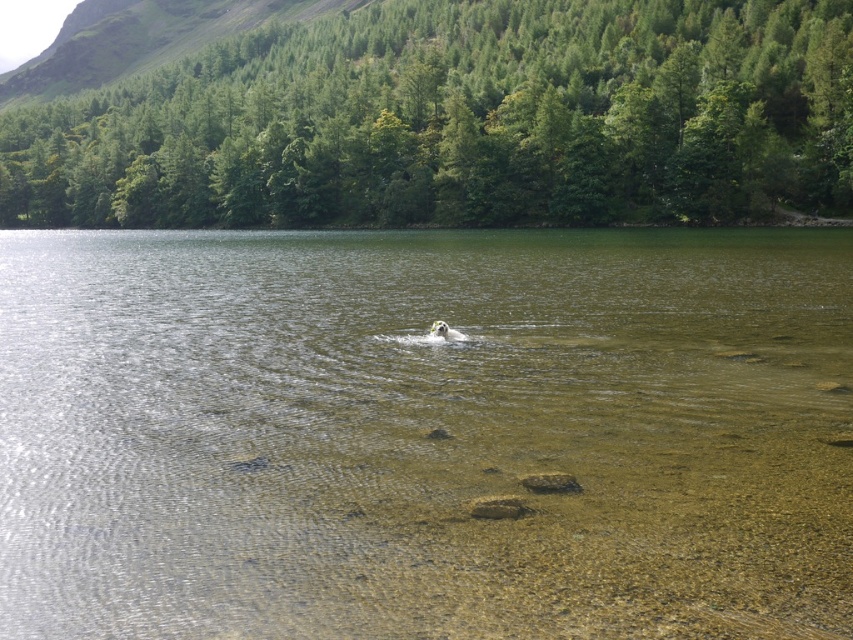
Is clear water at center behind white fluffy dog at center?

No, it is not.

Which is more to the right, clear water at center or white fluffy dog at center?

white fluffy dog at center

I want to click on clear water at center, so click(424, 433).